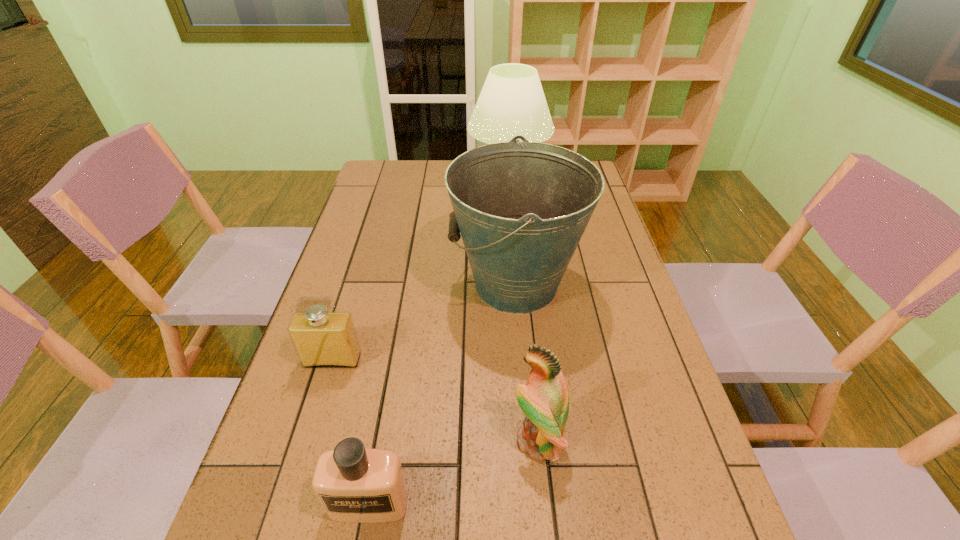
Find the location of `the farthest object`. the farthest object is located at coordinates (512, 102).

The width and height of the screenshot is (960, 540). Identify the location of the second farthest object. (522, 207).

Where is `parrot`? parrot is located at coordinates (544, 399).

Image resolution: width=960 pixels, height=540 pixels. I want to click on the fourth farthest object, so click(544, 399).

I want to click on the farther perfume, so click(322, 339).

Identify the location of the left perfume. This screenshot has width=960, height=540. (322, 339).

Identify the location of the nearest object. (354, 485).

Identify the location of the right perfume. This screenshot has height=540, width=960. (354, 485).

This screenshot has width=960, height=540. I want to click on vacant space located 0.090m on the shade of the lampshade, so click(444, 180).

The height and width of the screenshot is (540, 960). In order to click on vacant space located on the shade of the lampshade in this screenshot , I will do `click(372, 180)`.